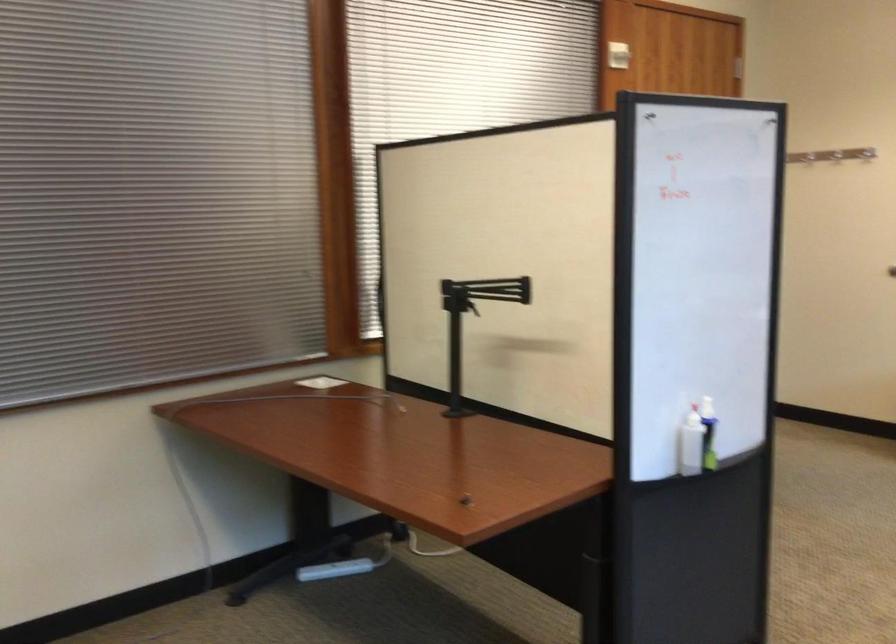
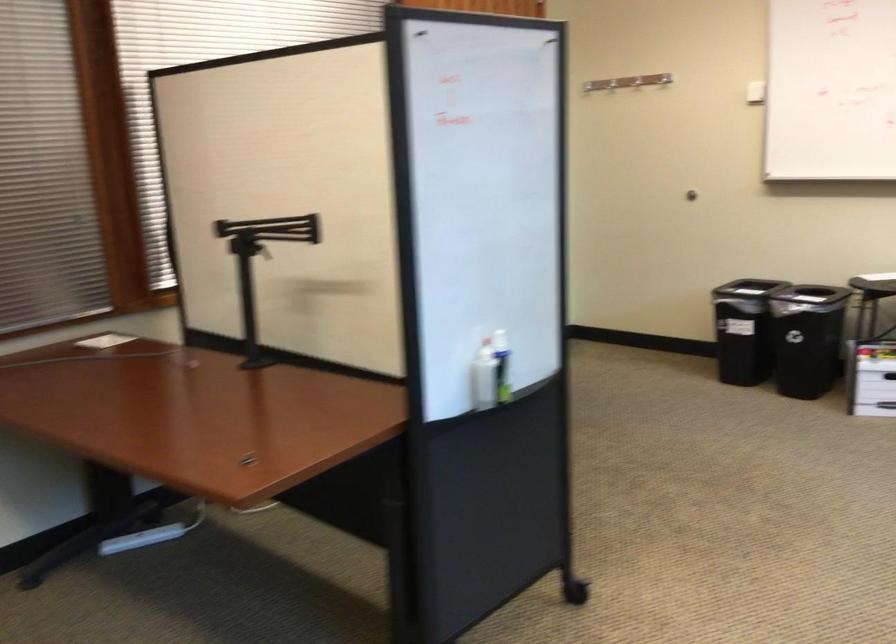
Find the pixel in the second image that matches (464,319) in the first image.

(261, 263)